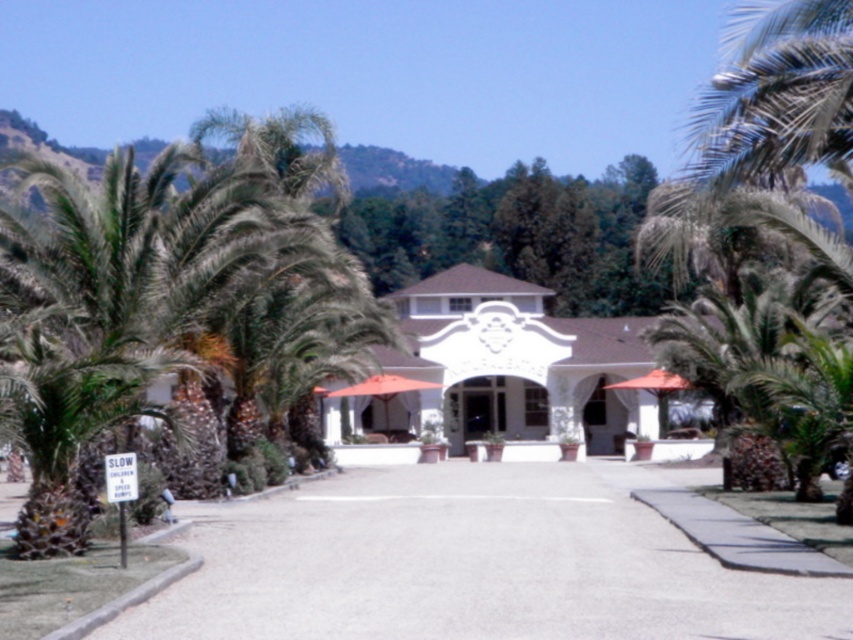
You are a visitor approaching the resort entrance and notice the gray gravel road at lower left and the green leafy palm tree at right. Which one appears taller from your perspective?

The green leafy palm tree at right is taller than the gray gravel road at lower left.

You are standing at the entrance of the resort and want to take a photo of the white stucco building at center. Based on its position, where should you stand to ensure it is centered in your camera frame?

The white stucco building at center is located at point (506,368), so you should position yourself slightly to the right and lower your camera angle slightly to center it in the frame.